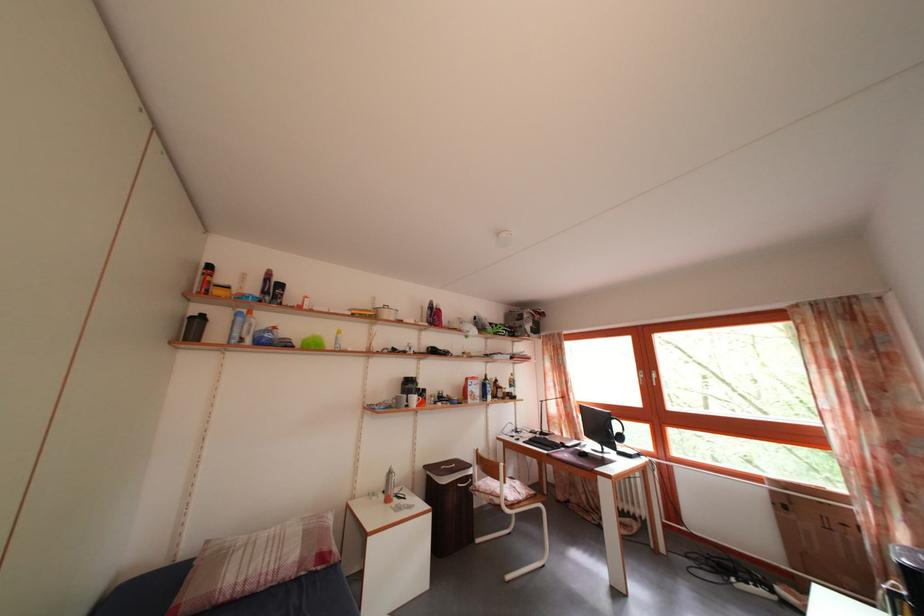
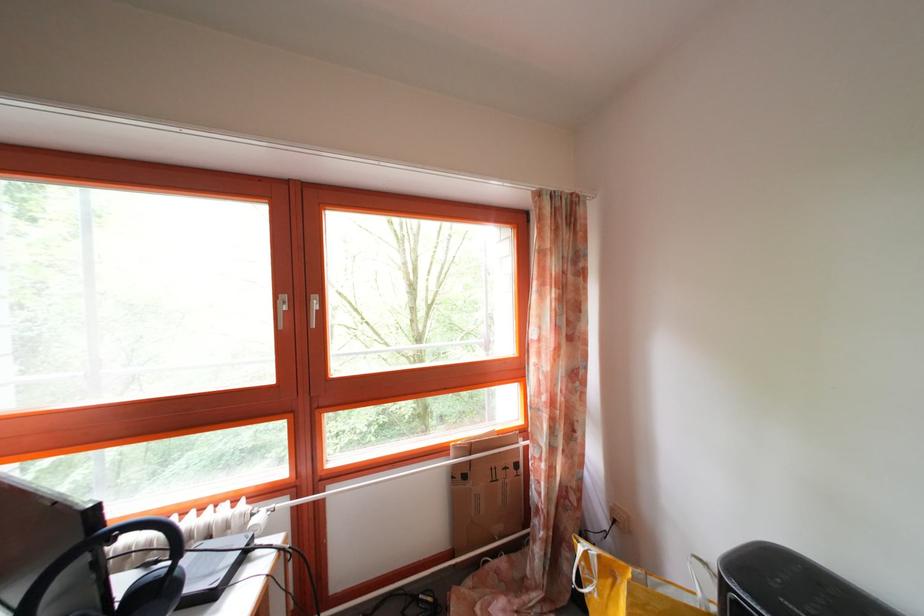
In the second image, find the point that corresponds to point (793, 514) in the first image.

(472, 484)